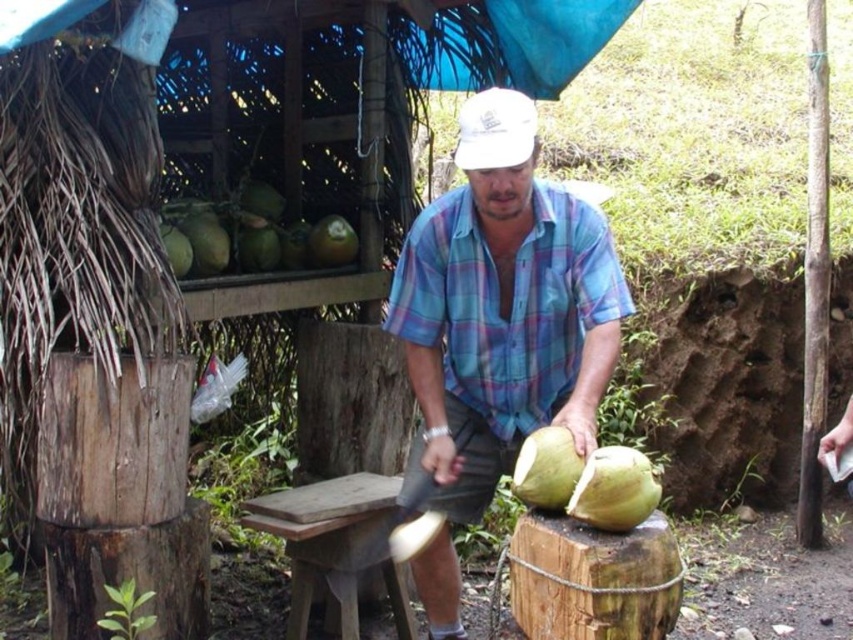
You are a customer observing the man opening coconuts and notice the white matte baseball cap at center and the green rough coconut at center. Which object is located to the left of the other?

The white matte baseball cap at center is positioned on the left side of green rough coconut at center.

You are a coconut farmer standing at the edge of your farm. You see the green matte coconut at center in front of you. Can you reach it with a 1.5 meter long pole?

The green matte coconut at center is 1.86 meters away from the viewer, which is farther than the 1.5 meter long pole. Therefore, you cannot reach it with the pole.